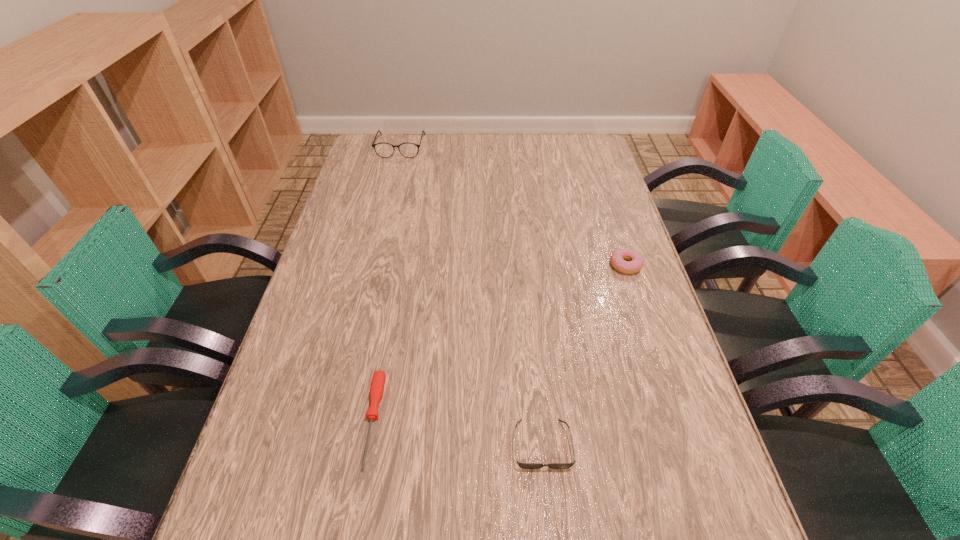
Identify the location of free location that satisfies the following two spatial constraints: 1. on the front-facing side of the second farthest object; 2. on the right side of the tallest object. (372, 265).